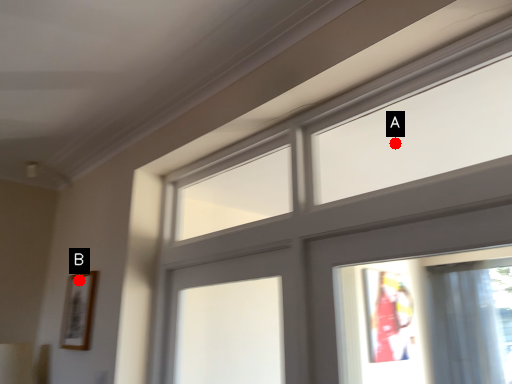
Question: Two points are circled on the image, labeled by A and B beside each circle. Among these points, which one is farthest from the camera?

Choices:
 (A) A is further
 (B) B is further

Answer: (B)